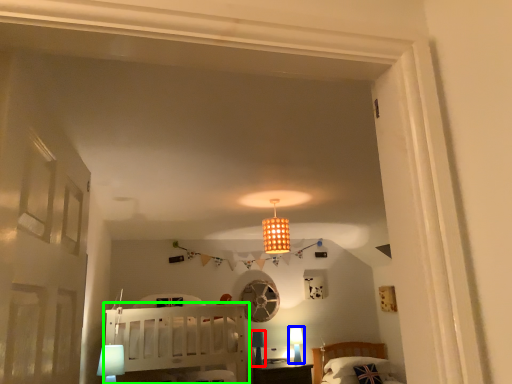
Question: Based on their relative distances, which object is farther from table lamp (highlighted by a red box)? Choose from table lamp (highlighted by a blue box) and furniture (highlighted by a green box).

Choices:
 (A) table lamp
 (B) furniture

Answer: (B)